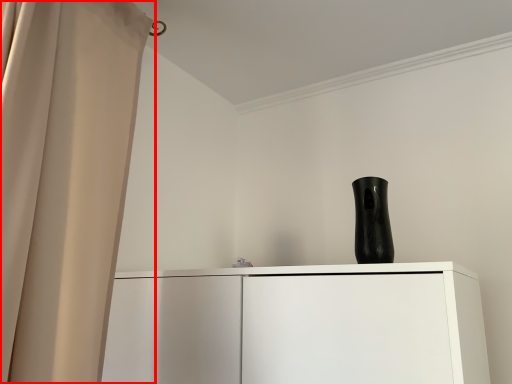
Question: Considering the relative positions of curtain (annotated by the red box) and vase in the image provided, where is curtain (annotated by the red box) located with respect to the staircase?

Choices:
 (A) right
 (B) left

Answer: (B)